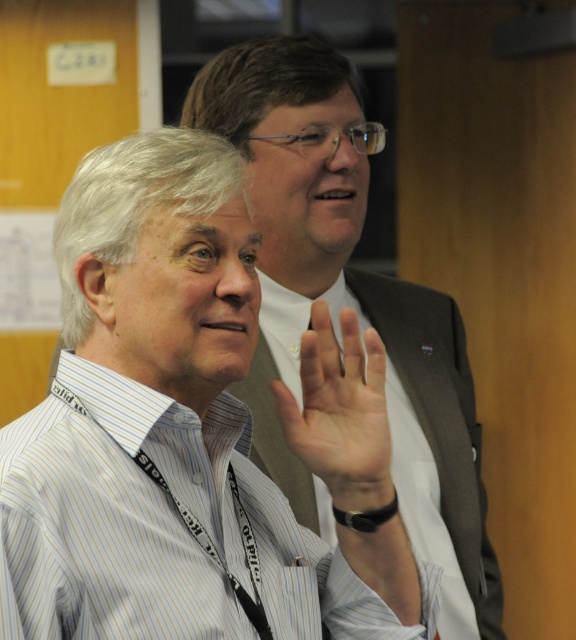
Question: Which of these objects is positioned farthest from the gray fabric business suit at center?

Choices:
 (A) white striped dress shirt at center
 (B) pale skin palm at center

Answer: (B)

Question: Can you confirm if white striped dress shirt at center is wider than gray fabric business suit at center?

Choices:
 (A) no
 (B) yes

Answer: (B)

Question: Which object is the farthest from the gray fabric business suit at center?

Choices:
 (A) white striped dress shirt at center
 (B) pale skin palm at center

Answer: (B)

Question: Is gray fabric business suit at center further to camera compared to pale skin palm at center?

Choices:
 (A) no
 (B) yes

Answer: (B)

Question: Based on their relative distances, which object is farther from the pale skin palm at center?

Choices:
 (A) gray fabric business suit at center
 (B) white striped dress shirt at center

Answer: (A)

Question: Does white striped dress shirt at center come in front of gray fabric business suit at center?

Choices:
 (A) no
 (B) yes

Answer: (B)